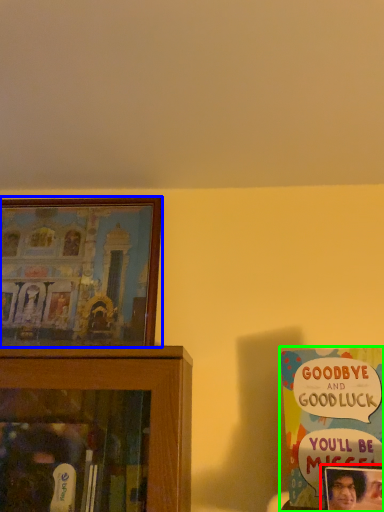
Question: Which is nearer to the picture frame (highlighted by a red box)? picture frame (highlighted by a blue box) or book (highlighted by a green box).

Choices:
 (A) picture frame
 (B) book

Answer: (B)